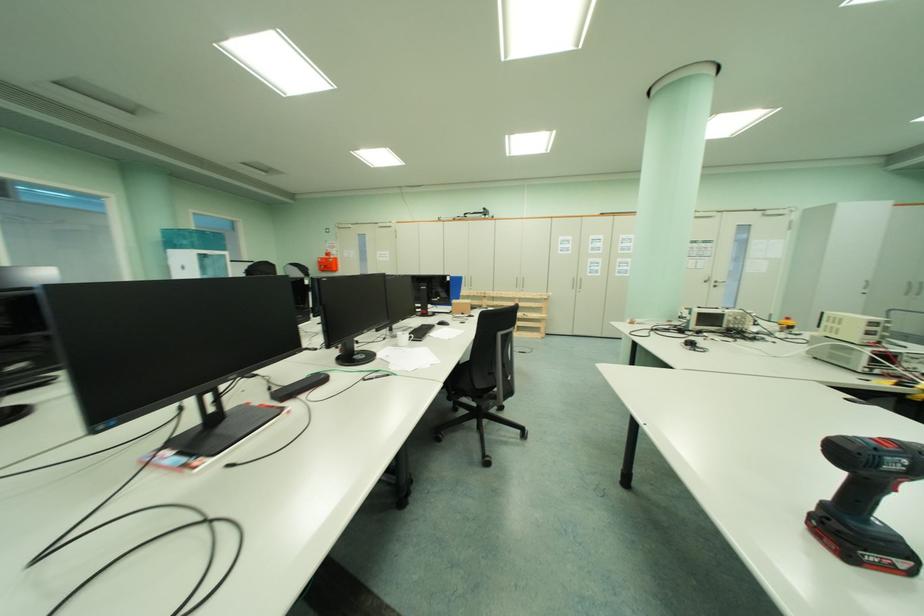
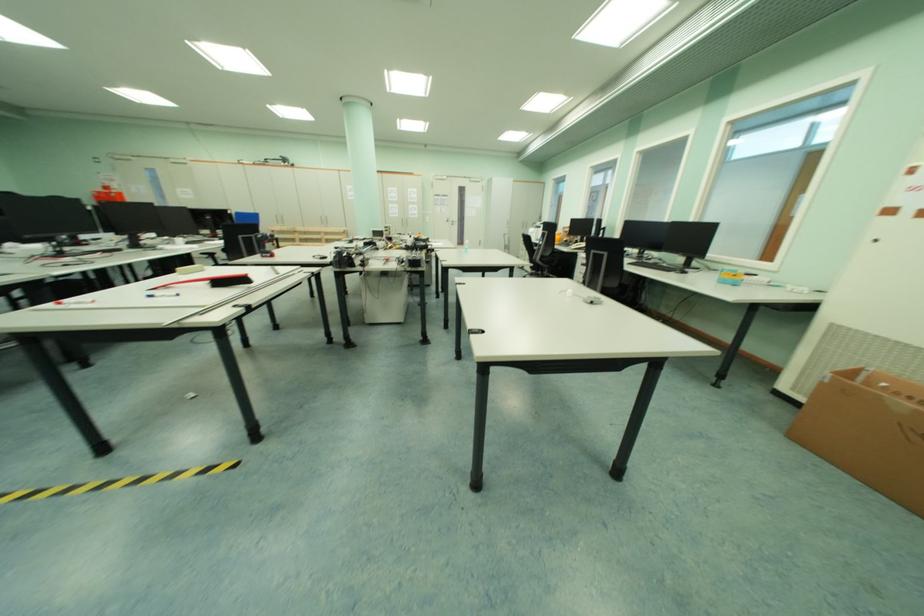
Based on the photo, in a continuous first-person perspective shot, in which direction is the camera moving?

The cameraman moved toward right, backward.